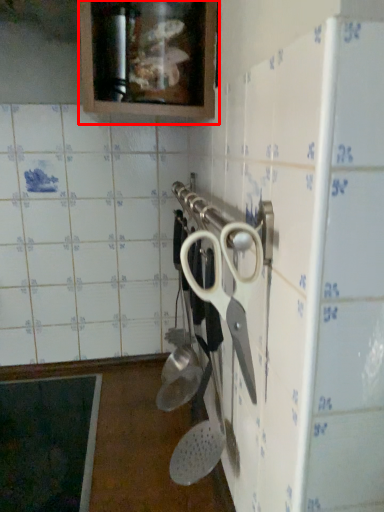
Question: Observing the image, what is the correct spatial positioning of cabinetry (annotated by the red box) in reference to scissors?

Choices:
 (A) right
 (B) left

Answer: (B)